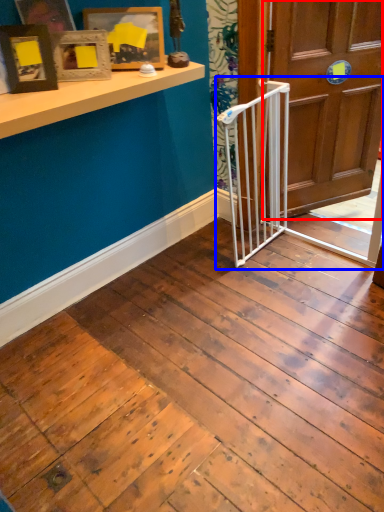
Question: Which point is closer to the camera, door (highlighted by a red box) or rail (highlighted by a blue box)?

Choices:
 (A) door
 (B) rail

Answer: (B)